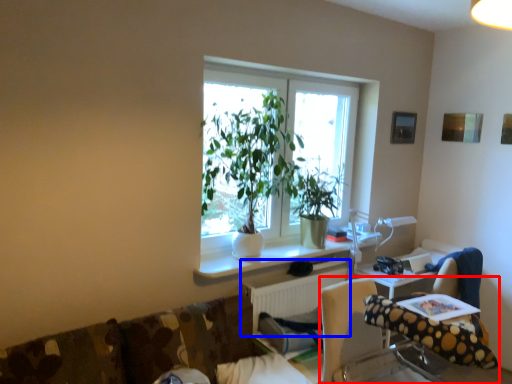
Question: Which object is closer to the camera taking this photo, chair (highlighted by a red box) or radiator (highlighted by a blue box)?

Choices:
 (A) chair
 (B) radiator

Answer: (A)